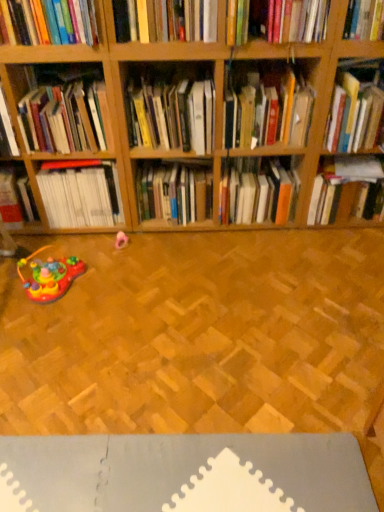
Question: Could you tell me if hardcover book at upper center, the 8th book positioned from the right, is turned towards hardcover book at center, arranged as the eighth book when viewed from the left?

Choices:
 (A) no
 (B) yes

Answer: (A)

Question: From a real-world perspective, does hardcover book at upper center, which ranks as the 5th book in left-to-right order, sit lower than hardcover book at center, arranged as the eighth book when viewed from the left?

Choices:
 (A) yes
 (B) no

Answer: (B)

Question: Does hardcover book at upper center, which ranks as the 5th book in left-to-right order, appear on the left side of hardcover book at center, which is the fifth book in right-to-left order?

Choices:
 (A) no
 (B) yes

Answer: (B)

Question: From the image's perspective, does hardcover book at upper center, which ranks as the 5th book in left-to-right order, appear higher than hardcover book at center, which is the fifth book in right-to-left order?

Choices:
 (A) yes
 (B) no

Answer: (A)

Question: Considering the positions of hardcover book at upper center, the 8th book positioned from the right, and hardcover book at left, the 1th book viewed from the left, in the image, is hardcover book at upper center, the 8th book positioned from the right, taller or shorter than hardcover book at left, the 1th book viewed from the left,?

Choices:
 (A) short
 (B) tall

Answer: (A)

Question: From the image's perspective, is hardcover book at upper center, which ranks as the 5th book in left-to-right order, above or below hardcover book at left, the 1th book viewed from the left?

Choices:
 (A) above
 (B) below

Answer: (A)

Question: Does point (132, 10) appear closer or farther from the camera than point (59, 143)?

Choices:
 (A) farther
 (B) closer

Answer: (B)

Question: Considering their positions, is hardcover book at upper center, which ranks as the 5th book in left-to-right order, located in front of or behind hardcover book at left, which appears as the twelfth book when viewed from the right?

Choices:
 (A) front
 (B) behind

Answer: (A)

Question: In the image, is hardcover book at center, which ranks as the seventh book in right-to-left order, positioned in front of or behind hardcover book at upper center, the 8th book positioned from the right?

Choices:
 (A) behind
 (B) front

Answer: (A)

Question: In terms of width, does hardcover book at center, the 6th book when ordered from left to right, look wider or thinner when compared to hardcover book at upper center, the 8th book positioned from the right?

Choices:
 (A) thin
 (B) wide

Answer: (B)

Question: Is point (188, 196) positioned closer to the camera than point (210, 6)?

Choices:
 (A) farther
 (B) closer

Answer: (A)

Question: From a real-world perspective, is hardcover book at center, which ranks as the seventh book in right-to-left order, physically located above or below hardcover book at upper center, the 8th book positioned from the right?

Choices:
 (A) below
 (B) above

Answer: (A)

Question: Is hardcover book at center, which ranks as the seventh book in right-to-left order, in front of or behind hardcover book at center, which ranks as the 4th book in right-to-left order, in the image?

Choices:
 (A) behind
 (B) front

Answer: (A)

Question: Based on their positions, is hardcover book at center, which ranks as the seventh book in right-to-left order, located to the left or right of hardcover book at center, the ninth book in the left-to-right sequence?

Choices:
 (A) right
 (B) left

Answer: (B)